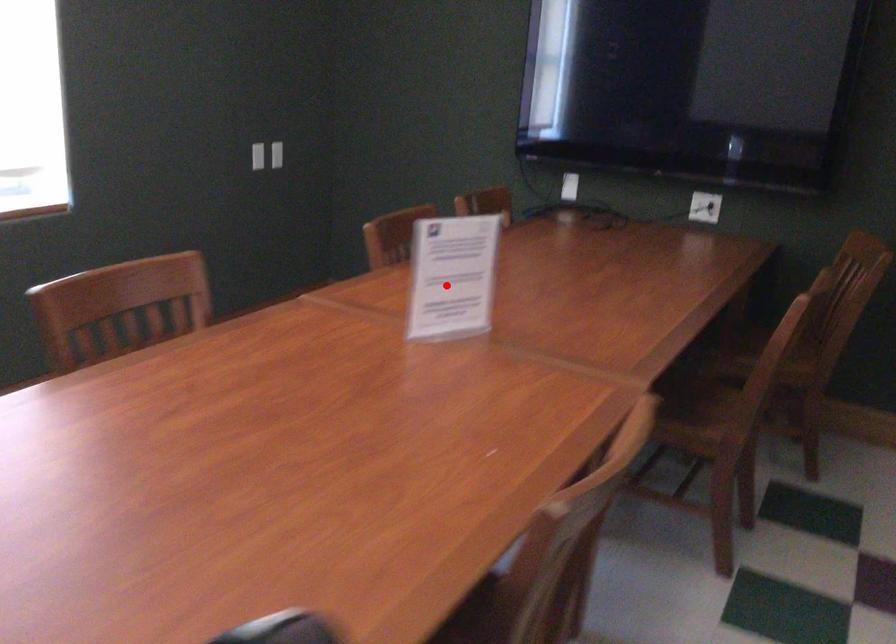
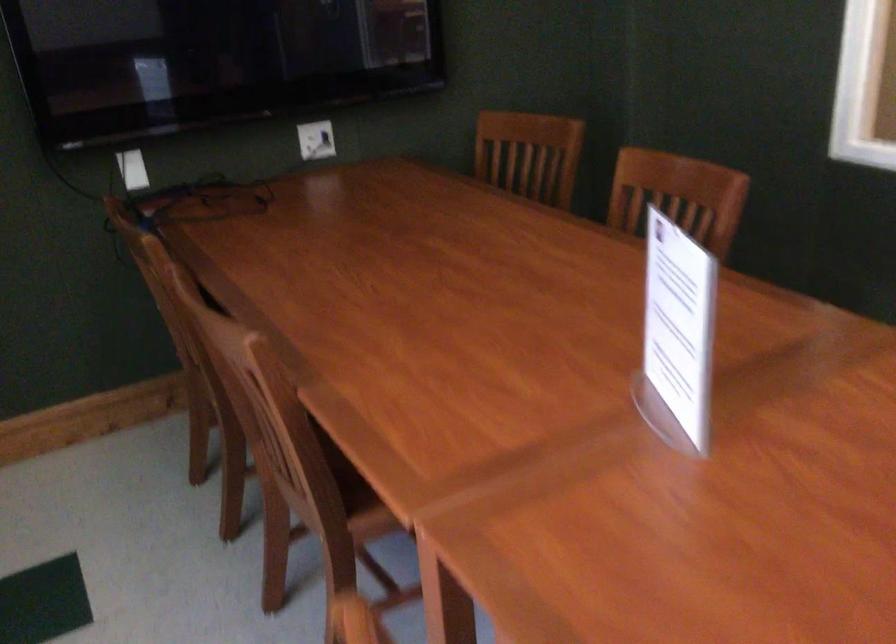
Find the pixel in the second image that matches the highlighted location in the first image.

(677, 335)